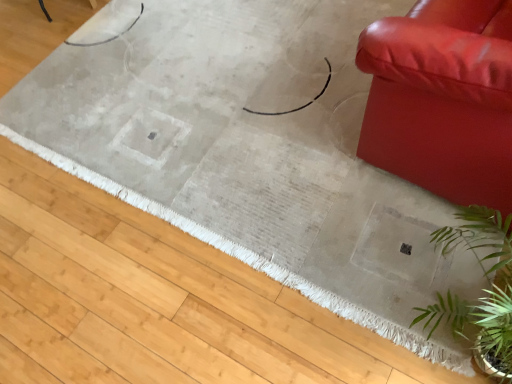
Locate an element on the screen. The image size is (512, 384). vacant region under green leafy plant at lower right (from a real-world perspective) is located at coordinates (441, 340).